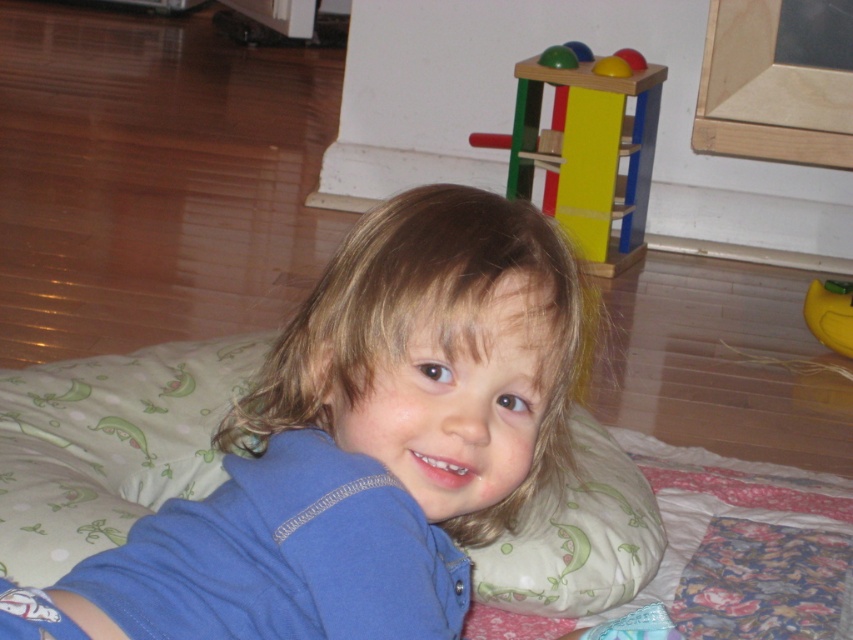
Question: Is smooth yellow ball at upper right to the left of smooth plastic toy at upper center from the viewer's perspective?

Choices:
 (A) yes
 (B) no

Answer: (B)

Question: Is blue cotton shirt at center further to the viewer compared to green fabric pillow at lower center?

Choices:
 (A) no
 (B) yes

Answer: (A)

Question: Which of the following is the farthest from the observer?

Choices:
 (A) (584, 51)
 (B) (479, 268)

Answer: (A)

Question: Considering the real-world distances, which object is closest to the smooth yellow cube at upper center?

Choices:
 (A) yellow rubber duck at lower right
 (B) wooden toy at upper right
 (C) green fabric pillow at lower center
 (D) smooth yellow ball at upper right

Answer: (D)

Question: Which object is positioned closest to the smooth plastic toy at upper center?

Choices:
 (A) green rubber ball at upper center
 (B) wooden toy at upper right

Answer: (A)

Question: Can you confirm if green fabric pillow at lower center is bigger than smooth plastic toy at upper center?

Choices:
 (A) yes
 (B) no

Answer: (A)